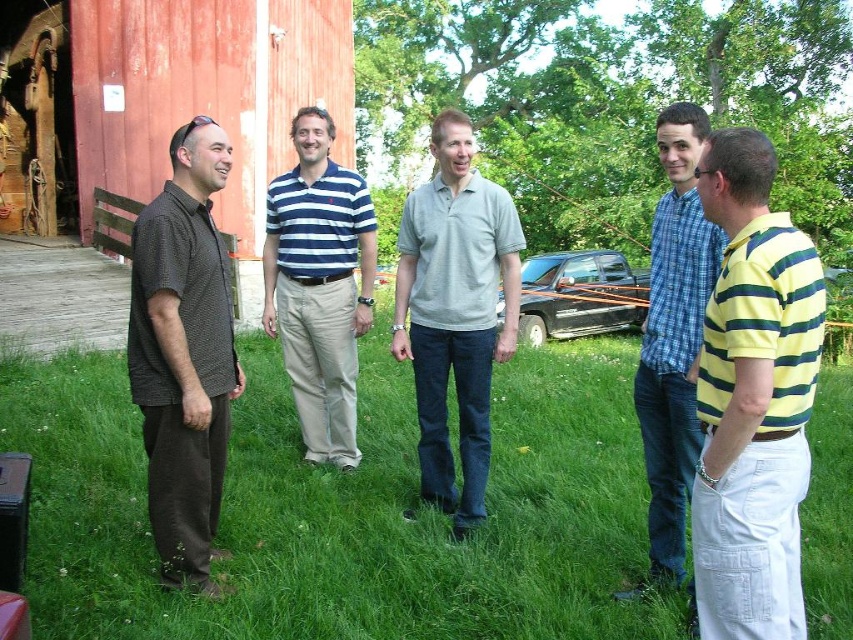
Can you confirm if yellow-green striped polo shirt at right is thinner than black matte truck at center?

Yes.

The height and width of the screenshot is (640, 853). Identify the location of yellow-green striped polo shirt at right. (753, 400).

Does yellow-green striped polo shirt at right have a greater width compared to dark brown textured shirt at left?

No.

Is point (785, 300) positioned after point (181, 554)?

No, it is not.

The width and height of the screenshot is (853, 640). Identify the location of yellow-green striped polo shirt at right. (753, 400).

Is green grass at center closer to camera compared to black matte truck at center?

That is True.

Which is above, green grass at center or black matte truck at center?

black matte truck at center

Where is `green grass at center`? green grass at center is located at coordinates (346, 509).